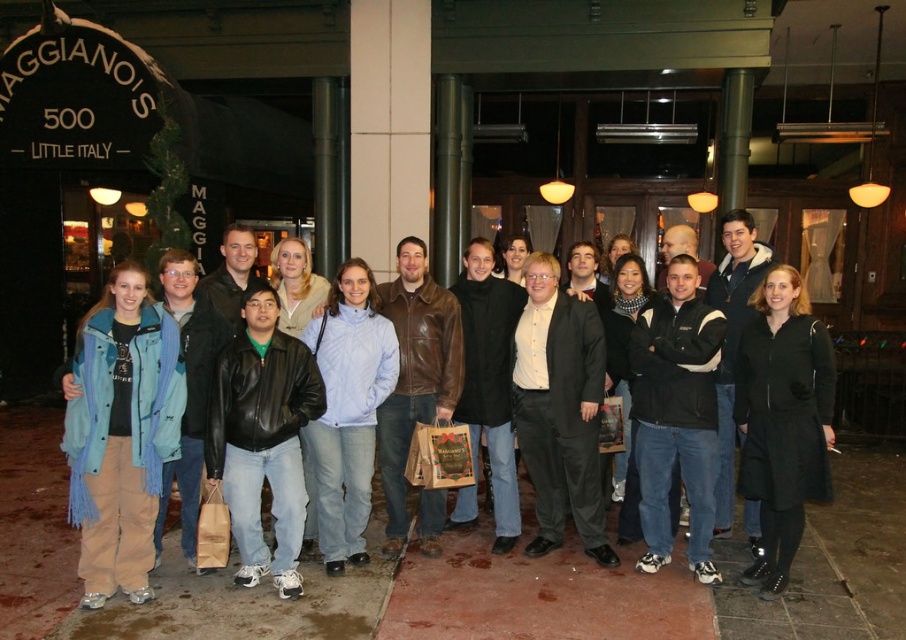
Question: From the image, what is the correct spatial relationship of black matte coat at center in relation to light blue fleece jacket at center?

Choices:
 (A) right
 (B) left

Answer: (A)

Question: Observing the image, what is the correct spatial positioning of black matte coat at center in reference to light blue fleece jacket at center?

Choices:
 (A) left
 (B) right

Answer: (B)

Question: Does black matte coat at center have a lesser width compared to light blue fleece jacket at center?

Choices:
 (A) no
 (B) yes

Answer: (B)